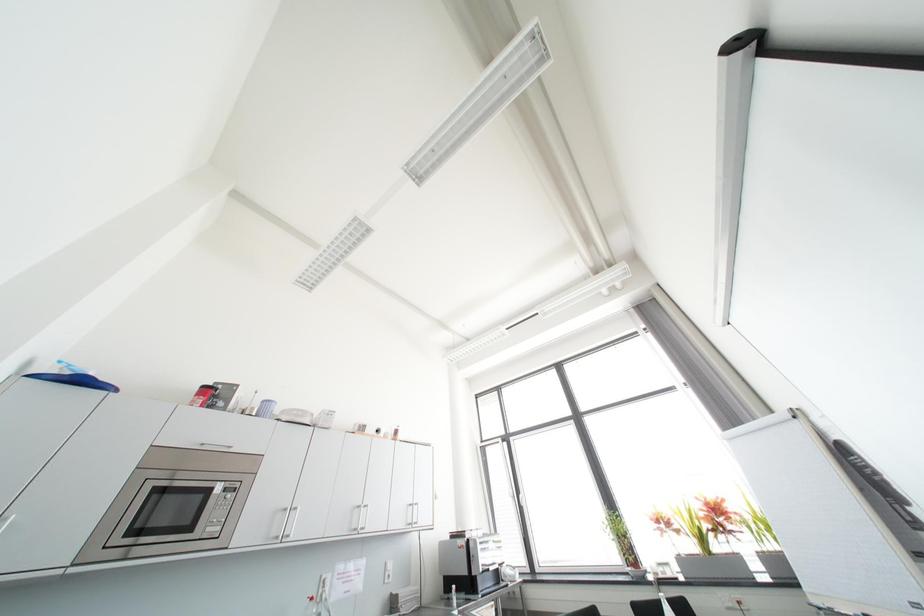
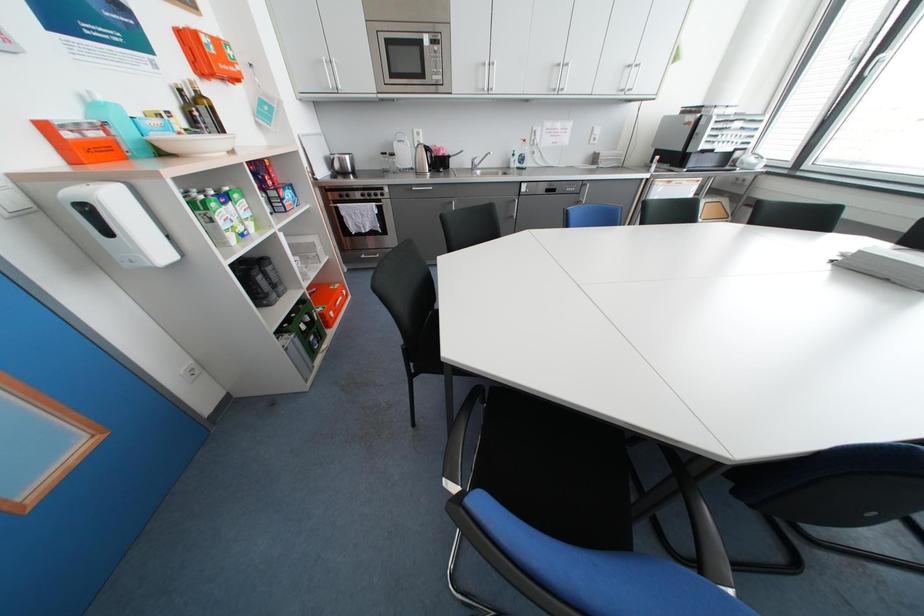
The first image is from the beginning of the video and the second image is from the end. How did the camera likely rotate when shooting the video?

The camera rotated toward left-down.